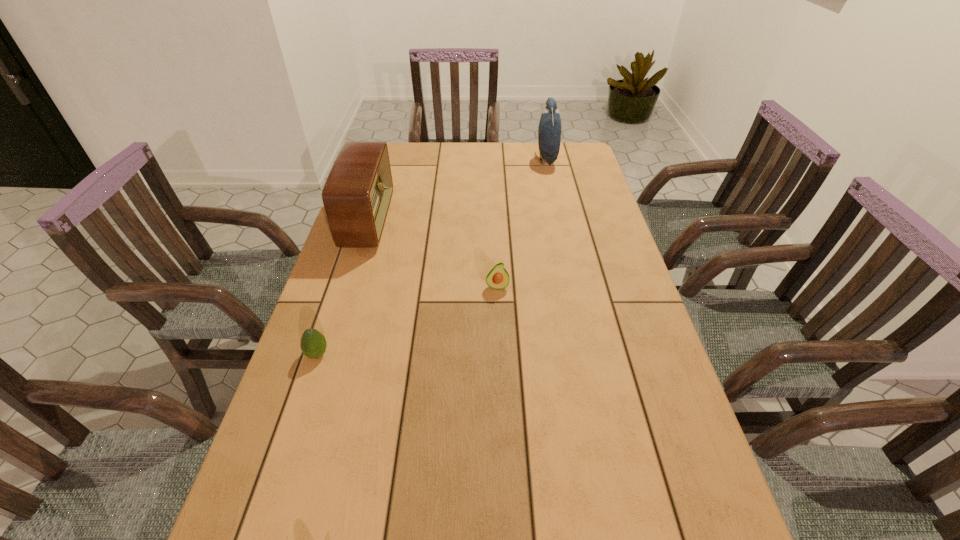
The image size is (960, 540). In order to click on vacant region located on the front-facing side of the second farthest object in this screenshot , I will do `click(454, 222)`.

Image resolution: width=960 pixels, height=540 pixels. I want to click on vacant space located on the cut side of the second object from right to left, so click(x=501, y=393).

Locate an element on the screen. This screenshot has width=960, height=540. free region located on the front of the nearest object is located at coordinates (271, 496).

Image resolution: width=960 pixels, height=540 pixels. I want to click on object that is at the far edge, so click(549, 130).

Locate an element on the screen. The width and height of the screenshot is (960, 540). radio receiver situated at the left edge is located at coordinates (357, 194).

I want to click on avocado positioned at the left edge, so click(x=313, y=344).

The height and width of the screenshot is (540, 960). In order to click on object present at the right edge in this screenshot , I will do `click(549, 130)`.

Find the location of a particular element. Image resolution: width=960 pixels, height=540 pixels. object located at the far right corner is located at coordinates (549, 130).

What are the coordinates of `vacant space at the far edge of the desktop` in the screenshot? It's located at (458, 146).

In the image, there is a desktop. At what (x,y) coordinates should I click in order to perform the action: click on vacant space at the left edge. Please return your answer as a coordinate pair (x, y). The width and height of the screenshot is (960, 540). Looking at the image, I should click on (394, 248).